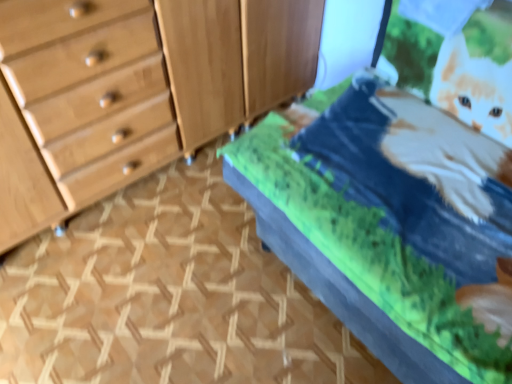
Question: Is velvet green bed at center shorter than light brown wood dresser at left?

Choices:
 (A) yes
 (B) no

Answer: (A)

Question: Is velvet green bed at center positioned far away from light brown wood dresser at left?

Choices:
 (A) no
 (B) yes

Answer: (A)

Question: Is velvet green bed at center bigger than light brown wood dresser at left?

Choices:
 (A) no
 (B) yes

Answer: (B)

Question: From the image's perspective, is velvet green bed at center below light brown wood dresser at left?

Choices:
 (A) no
 (B) yes

Answer: (B)

Question: Is velvet green bed at center smaller than light brown wood dresser at left?

Choices:
 (A) yes
 (B) no

Answer: (B)

Question: Are velvet green bed at center and light brown wood dresser at left beside each other?

Choices:
 (A) no
 (B) yes

Answer: (A)

Question: Is wooden cabinet at center positioned behind velvet green bed at center?

Choices:
 (A) no
 (B) yes

Answer: (B)

Question: Is velvet green bed at center surrounded by wooden cabinet at center?

Choices:
 (A) yes
 (B) no

Answer: (B)

Question: Is wooden cabinet at center facing towards velvet green bed at center?

Choices:
 (A) no
 (B) yes

Answer: (B)

Question: Can you confirm if wooden cabinet at center is positioned to the right of velvet green bed at center?

Choices:
 (A) no
 (B) yes

Answer: (A)

Question: Is wooden cabinet at center at the left side of velvet green bed at center?

Choices:
 (A) yes
 (B) no

Answer: (A)

Question: Considering the relative sizes of wooden cabinet at center and velvet green bed at center in the image provided, is wooden cabinet at center thinner than velvet green bed at center?

Choices:
 (A) yes
 (B) no

Answer: (A)

Question: From the image's perspective, is light brown wood dresser at left below wooden cabinet at center?

Choices:
 (A) no
 (B) yes

Answer: (B)